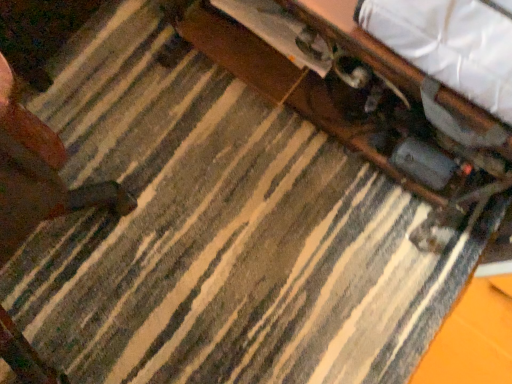
Question: From their relative heights in the image, would you say wooden drawer at upper center is taller or shorter than white fabric at upper right?

Choices:
 (A) short
 (B) tall

Answer: (A)

Question: From a real-world perspective, is wooden drawer at upper center physically located above or below white fabric at upper right?

Choices:
 (A) below
 (B) above

Answer: (A)

Question: Which of these objects is positioned farthest from the wooden drawer at upper center?

Choices:
 (A) white fabric at upper right
 (B) wooden table at center

Answer: (A)

Question: Estimate the real-world distances between objects in this image. Which object is closer to the wooden drawer at upper center?

Choices:
 (A) white fabric at upper right
 (B) wooden table at center

Answer: (B)